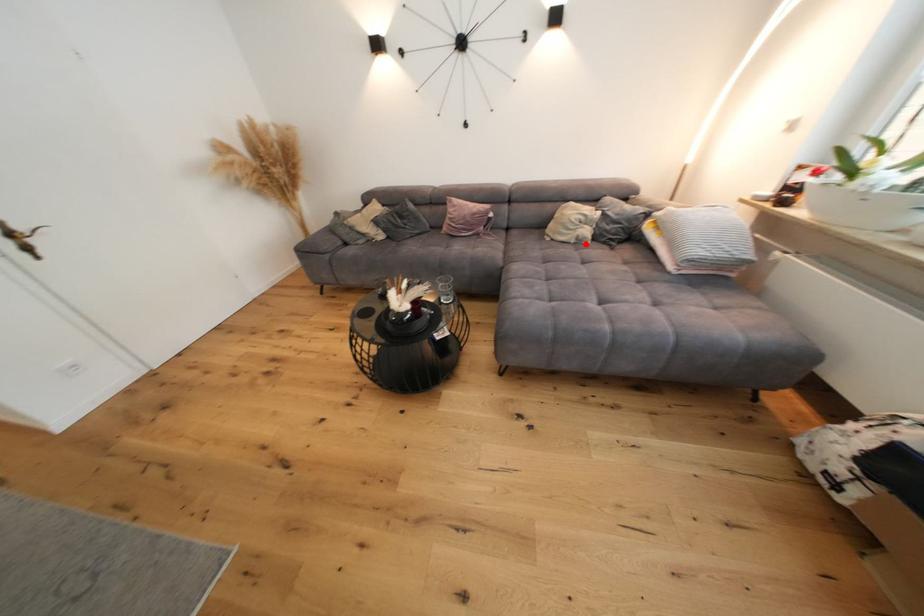
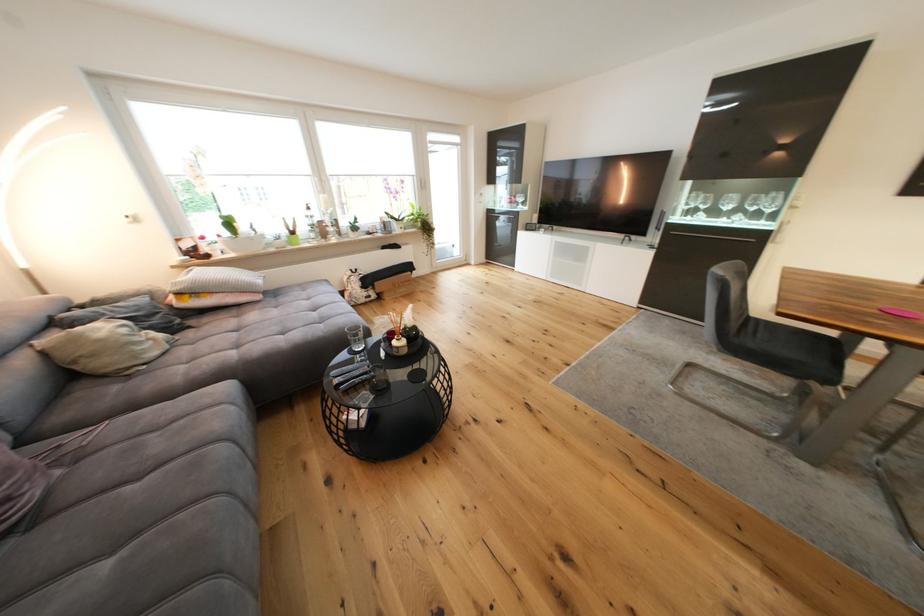
The point at the highlighted location is marked in the first image. Where is the corresponding point in the second image?

(178, 345)